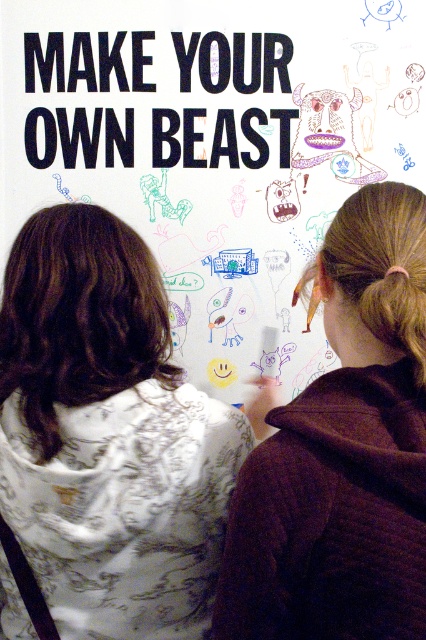
You are a photographer standing in front of the whiteboard. You want to take a photo of the brown quilted hoodie at upper right and the dark brown hair at upper left. If your camera has a zoom lens that can focus on objects within 12 inches of each other, will both subjects be in focus?

The brown quilted hoodie at upper right and dark brown hair at upper left are 13.34 inches apart, which is beyond the camera lens focus range of 12 inches. Therefore, both subjects cannot be in focus simultaneously.